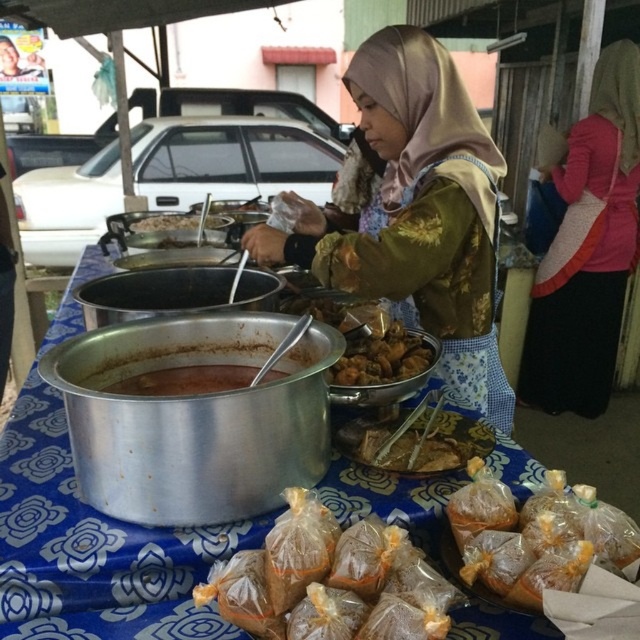
Looking at this image, you are a customer at the food stall and want to pick up both the translucent plastic bags at lower center and the shiny metallic bowl at center. Which one should you grab first if you want to reach the one closer to your right?

The shiny metallic bowl at center is to the right of the translucent plastic bags at lower center, so you should grab the shiny metallic bowl at center first to reach the one closer to your right.

You are a customer standing in front of the street food vendor. You want to grab the pink fabric at center to wipe your hands. Is it within your reach?

The pink fabric at center is 2.79 meters away from viewer, so it is too far to reach. You should ask the vendor for a napkin instead.

You are a customer at the street food vendor stall. You see the point at coordinates (93, 547). What object is located at that point?

The point at coordinates (93, 547) is on the silver metallic table at center.